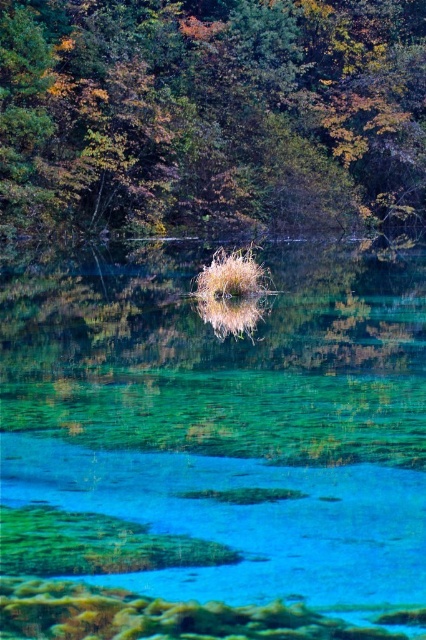
You are a boat operator planning to navigate a boat with a 2.5 meter width through the center of the image. Given the presence of clear glass water at center and dry grass at center, which area can safely accommodate your boat?

The clear glass water at center might be wider than dry grass at center, so the boat operator should navigate through the clear glass water at center as it likely has sufficient width to accommodate the boat.

You are standing at the center of the image and want to locate the green leafy tree at upper center. Which direction should you look to find it?

The green leafy tree at upper center is located at point coordinates of (210,115), so you should look towards the upper center direction to find it.

You are a drone operator trying to capture the reflection of the island in the clear glass water at center. Based on the coordinates provided, where should you position the drone to ensure the reflection is centered in your shot?

The clear glass water at center is located at point (213, 451), so positioning the drone at these coordinates will center the reflection of the island in the shot.